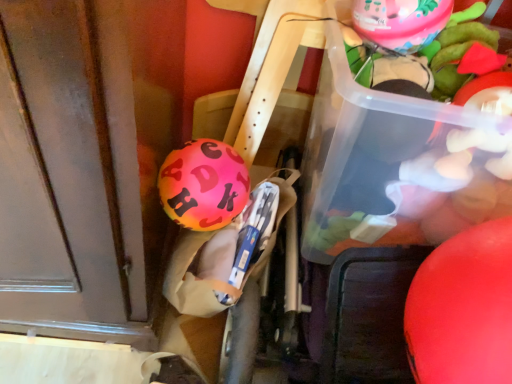
Image resolution: width=512 pixels, height=384 pixels. What do you see at coordinates (397, 165) in the screenshot? I see `translucent plastic container at upper right` at bounding box center [397, 165].

The width and height of the screenshot is (512, 384). What do you see at coordinates (463, 309) in the screenshot? I see `rubber matte balloon at right, the first balloon in the right-to-left sequence` at bounding box center [463, 309].

This screenshot has height=384, width=512. Describe the element at coordinates (401, 22) in the screenshot. I see `pink rubber balloon at upper right, positioned as the 2th balloon in left-to-right order` at that location.

Identify the location of translucent plastic container at upper right. (397, 165).

Considering the points (174, 176) and (414, 167), which point is behind, point (174, 176) or point (414, 167)?

The point (414, 167) is farther.

Find the location of a particular element. the 2nd balloon counting from the left of the translucent plastic container at upper right is located at coordinates (203, 185).

Are shiny pink balloon at center, arranged as the first balloon when viewed from the left, and translucent plastic container at upper right making contact?

shiny pink balloon at center, arranged as the first balloon when viewed from the left, and translucent plastic container at upper right are clearly separated.

Who is taller, rubber matte balloon at right, the first balloon from the bottom, or pink rubber balloon at upper right, marked as the first balloon in a top-to-bottom arrangement?

Standing taller between the two is rubber matte balloon at right, the first balloon from the bottom.

Is rubber matte balloon at right, which ranks as the third balloon in left-to-right order, wider than pink rubber balloon at upper right, positioned as the 2th balloon in left-to-right order?

Yes.

Is the surface of rubber matte balloon at right, which ranks as the third balloon in left-to-right order, in direct contact with pink rubber balloon at upper right, marked as the first balloon in a top-to-bottom arrangement?

No, rubber matte balloon at right, which ranks as the third balloon in left-to-right order, is not in contact with pink rubber balloon at upper right, marked as the first balloon in a top-to-bottom arrangement.

From the image's perspective, which is below, rubber matte balloon at right, which ranks as the third balloon in left-to-right order, or pink rubber balloon at upper right, positioned as the 2th balloon in left-to-right order?

rubber matte balloon at right, which ranks as the third balloon in left-to-right order.

Does translucent plastic container at upper right contain pink rubber balloon at upper right, placed as the third balloon when sorted from bottom to top?

Actually, pink rubber balloon at upper right, placed as the third balloon when sorted from bottom to top, is outside translucent plastic container at upper right.

Is there a large distance between translucent plastic container at upper right and pink rubber balloon at upper right, marked as the first balloon in a top-to-bottom arrangement?

No, translucent plastic container at upper right is not far from pink rubber balloon at upper right, marked as the first balloon in a top-to-bottom arrangement.

From a real-world perspective, is translucent plastic container at upper right physically below pink rubber balloon at upper right, positioned as the 2th balloon in left-to-right order?

Yes.

Is point (380, 189) positioned behind point (370, 35)?

Yes, point (380, 189) is farther from viewer.

Measure the distance from pink rubber balloon at upper right, positioned as the 2th balloon in left-to-right order, to rubber matte balloon at right, which ranks as the third balloon in left-to-right order.

They are 16.93 inches apart.

Is pink rubber balloon at upper right, placed as the third balloon when sorted from bottom to top, not within rubber matte balloon at right, the first balloon in the right-to-left sequence?

pink rubber balloon at upper right, placed as the third balloon when sorted from bottom to top, lies outside rubber matte balloon at right, the first balloon in the right-to-left sequence,'s area.

Can you tell me how much pink rubber balloon at upper right, placed as the third balloon when sorted from bottom to top, and rubber matte balloon at right, which is the 3th balloon in top-to-bottom order, differ in facing direction?

Result: The angular difference between pink rubber balloon at upper right, placed as the third balloon when sorted from bottom to top, and rubber matte balloon at right, which is the 3th balloon in top-to-bottom order, is 82.9 degrees.

Which point is more forward, (378, 22) or (408, 353)?

The point (378, 22) is closer.

What's the angular difference between rubber matte balloon at right, which ranks as the third balloon in left-to-right order, and shiny pink balloon at center, the 2th balloon from the bottom,'s facing directions?

They differ by 90.4 degrees in their facing directions.

From the image's perspective, does rubber matte balloon at right, which ranks as the third balloon in left-to-right order, appear higher than shiny pink balloon at center, acting as the third balloon starting from the right?

No, from the image's perspective, rubber matte balloon at right, which ranks as the third balloon in left-to-right order, is not above shiny pink balloon at center, acting as the third balloon starting from the right.

Are rubber matte balloon at right, which ranks as the third balloon in left-to-right order, and shiny pink balloon at center, arranged as the first balloon when viewed from the left, located far from each other?

No, rubber matte balloon at right, which ranks as the third balloon in left-to-right order, is not far from shiny pink balloon at center, arranged as the first balloon when viewed from the left.

Which is less distant, (484, 247) or (170, 208)?

The point (484, 247) is in front.

Between point (219, 204) and point (479, 292), which one is positioned in front?

The point (479, 292) is closer to the camera.

You are a GUI agent. You are given a task and a screenshot of the screen. Output one action in this format:
    pyautogui.click(x=<x>, y=<y>)
    Task: Click on the 1st balloon located above the shiny pink balloon at center, which is the second balloon in top-to-bottom order (from a real-world perspective)
    This screenshot has height=384, width=512.
    Given the screenshot: What is the action you would take?
    pyautogui.click(x=463, y=309)

Considering the relative sizes of shiny pink balloon at center, the 2th balloon from the bottom, and rubber matte balloon at right, which is the 3th balloon in top-to-bottom order, in the image provided, is shiny pink balloon at center, the 2th balloon from the bottom, smaller than rubber matte balloon at right, which is the 3th balloon in top-to-bottom order,?

Indeed, shiny pink balloon at center, the 2th balloon from the bottom, has a smaller size compared to rubber matte balloon at right, which is the 3th balloon in top-to-bottom order.

Is translucent plastic container at upper right not near shiny pink balloon at center, which is the second balloon in top-to-bottom order?

That's not correct — translucent plastic container at upper right is a little close to shiny pink balloon at center, which is the second balloon in top-to-bottom order.

Based on the photo, is translucent plastic container at upper right to the right of shiny pink balloon at center, the 2th balloon from the bottom, from the viewer's perspective?

Yes.

Is shiny pink balloon at center, acting as the third balloon starting from the right, a part of translucent plastic container at upper right?

Definitely not — shiny pink balloon at center, acting as the third balloon starting from the right, is not inside translucent plastic container at upper right.

From a real-world perspective, which is physically above, translucent plastic container at upper right or shiny pink balloon at center, the 2th balloon from the bottom?

From a 3D spatial view, translucent plastic container at upper right is above.

You are a GUI agent. You are given a task and a screenshot of the screen. Output one action in this format:
    pyautogui.click(x=<x>, y=<y>)
    Task: Click on the wide that appears in front of the shiny pink balloon at center, arranged as the first balloon when viewed from the left
    The height and width of the screenshot is (384, 512).
    Given the screenshot: What is the action you would take?
    pyautogui.click(x=397, y=165)

Identify the location of balloon that is the 1st one below the pink rubber balloon at upper right, positioned as the second balloon in right-to-left order (from a real-world perspective). (463, 309).

Based on their spatial positions, is pink rubber balloon at upper right, positioned as the 2th balloon in left-to-right order, or rubber matte balloon at right, the first balloon in the right-to-left sequence, closer to translucent plastic container at upper right?

The object closer to translucent plastic container at upper right is rubber matte balloon at right, the first balloon in the right-to-left sequence.

Estimate the real-world distances between objects in this image. Which object is further from pink rubber balloon at upper right, positioned as the second balloon in right-to-left order, translucent plastic container at upper right or shiny pink balloon at center, arranged as the first balloon when viewed from the left?

The object further to pink rubber balloon at upper right, positioned as the second balloon in right-to-left order, is shiny pink balloon at center, arranged as the first balloon when viewed from the left.

In the scene shown: From the image, which object appears to be nearer to rubber matte balloon at right, which ranks as the third balloon in left-to-right order, shiny pink balloon at center, which is the second balloon in top-to-bottom order, or pink rubber balloon at upper right, placed as the third balloon when sorted from bottom to top?

shiny pink balloon at center, which is the second balloon in top-to-bottom order, is closer to rubber matte balloon at right, which ranks as the third balloon in left-to-right order.

Which object lies nearer to the anchor point pink rubber balloon at upper right, positioned as the 2th balloon in left-to-right order, shiny pink balloon at center, arranged as the first balloon when viewed from the left, or rubber matte balloon at right, which ranks as the third balloon in left-to-right order?

Based on the image, shiny pink balloon at center, arranged as the first balloon when viewed from the left, appears to be nearer to pink rubber balloon at upper right, positioned as the 2th balloon in left-to-right order.

Estimate the real-world distances between objects in this image. Which object is further from translucent plastic container at upper right, pink rubber balloon at upper right, positioned as the 2th balloon in left-to-right order, or shiny pink balloon at center, which is the second balloon in top-to-bottom order?

Among the two, shiny pink balloon at center, which is the second balloon in top-to-bottom order, is located further to translucent plastic container at upper right.

Estimate the real-world distances between objects in this image. Which object is closer to pink rubber balloon at upper right, marked as the first balloon in a top-to-bottom arrangement, rubber matte balloon at right, the first balloon from the bottom, or shiny pink balloon at center, the 2th balloon from the bottom?

Based on the image, shiny pink balloon at center, the 2th balloon from the bottom, appears to be nearer to pink rubber balloon at upper right, marked as the first balloon in a top-to-bottom arrangement.

Looking at the image, which one is located closer to rubber matte balloon at right, which ranks as the third balloon in left-to-right order, translucent plastic container at upper right or shiny pink balloon at center, which is the second balloon in top-to-bottom order?

translucent plastic container at upper right is positioned closer to the anchor rubber matte balloon at right, which ranks as the third balloon in left-to-right order.

Estimate the real-world distances between objects in this image. Which object is closer to shiny pink balloon at center, which is the second balloon in top-to-bottom order, translucent plastic container at upper right or pink rubber balloon at upper right, positioned as the second balloon in right-to-left order?

translucent plastic container at upper right lies closer to shiny pink balloon at center, which is the second balloon in top-to-bottom order, than the other object.

Where is `wide between shiny pink balloon at center, the 2th balloon from the bottom, and rubber matte balloon at right, which ranks as the third balloon in left-to-right order, from left to right`? wide between shiny pink balloon at center, the 2th balloon from the bottom, and rubber matte balloon at right, which ranks as the third balloon in left-to-right order, from left to right is located at coordinates [397, 165].

You are a GUI agent. You are given a task and a screenshot of the screen. Output one action in this format:
    pyautogui.click(x=<x>, y=<y>)
    Task: Click on the balloon located between shiny pink balloon at center, arranged as the first balloon when viewed from the left, and translucent plastic container at upper right in the left-right direction
    Image resolution: width=512 pixels, height=384 pixels.
    Given the screenshot: What is the action you would take?
    pyautogui.click(x=401, y=22)

You are a GUI agent. You are given a task and a screenshot of the screen. Output one action in this format:
    pyautogui.click(x=<x>, y=<y>)
    Task: Click on the wide between pink rubber balloon at upper right, placed as the third balloon when sorted from bottom to top, and rubber matte balloon at right, which is the 3th balloon in top-to-bottom order, in the vertical direction
    
    Given the screenshot: What is the action you would take?
    point(397,165)

Where is `balloon between shiny pink balloon at center, acting as the third balloon starting from the right, and rubber matte balloon at right, which ranks as the third balloon in left-to-right order`? The width and height of the screenshot is (512, 384). balloon between shiny pink balloon at center, acting as the third balloon starting from the right, and rubber matte balloon at right, which ranks as the third balloon in left-to-right order is located at coordinates (401, 22).